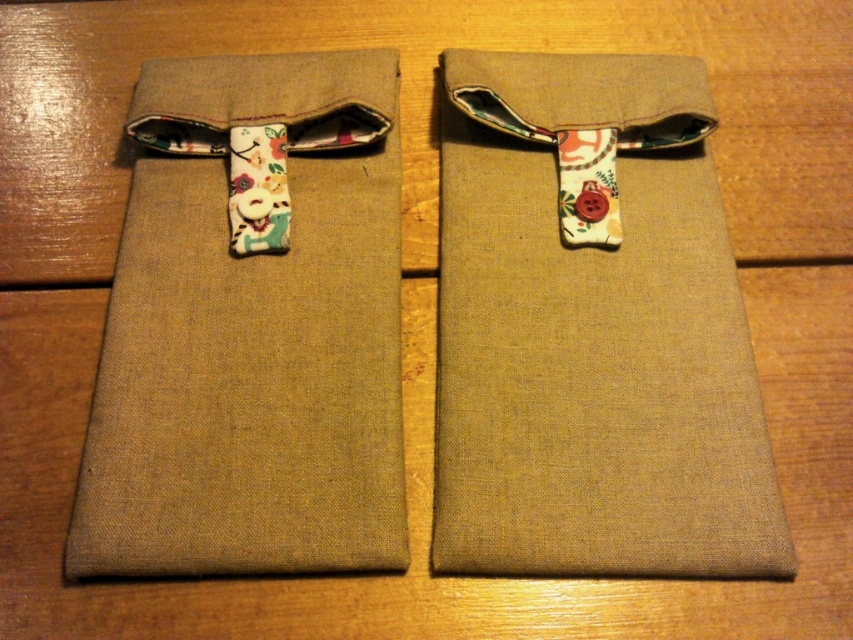
You are looking at two points on the wooden surface where the fabric pouches are placed. The points are labeled as point (560,173) and point (334,285). Which point is closer to you?

Point (560,173) is further to the camera than point (334,285), so point (334,285) is closer to you.

You are organizing items on a wooden table and see the matte beige fabric pouch at left and the floral fabric strap at upper center. Which object is positioned higher up on the table?

The floral fabric strap at upper center is positioned higher up on the table since the matte beige fabric pouch at left is located below it.